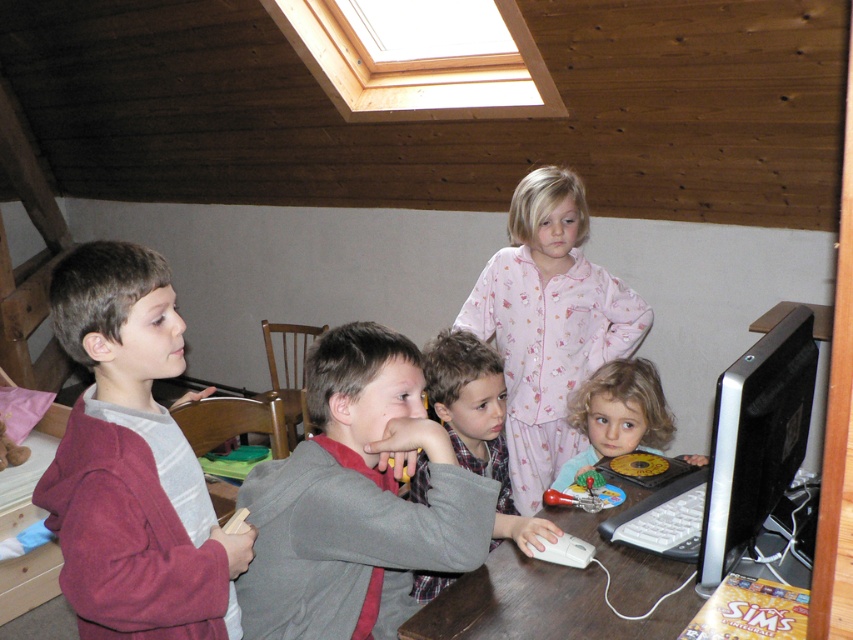
Who is more forward, [315,401] or [419,461]?

Point [315,401] is in front.

Is gray fabric shirt at center positioned at the back of gray flannel shirt at center?

No.

Is point (294, 634) farther from camera compared to point (467, 387)?

That is False.

At what (x,y) coordinates should I click in order to perform the action: click on gray fabric shirt at center. Please return your answer as a coordinate pair (x, y). The image size is (853, 640). Looking at the image, I should click on (352, 502).

Does brown wooden table at lower center have a lesser height compared to blonde curly hair at lower center?

Indeed, brown wooden table at lower center has a lesser height compared to blonde curly hair at lower center.

Between brown wooden table at lower center and blonde curly hair at lower center, which one has more height?

Standing taller between the two is blonde curly hair at lower center.

Identify the location of brown wooden table at lower center. (538, 604).

Which is in front, point (788, 328) or point (468, 465)?

Point (788, 328) is in front.

Is black glossy monitor at right smaller than gray flannel shirt at center?

Actually, black glossy monitor at right might be larger than gray flannel shirt at center.

Identify the location of black glossy monitor at right. The width and height of the screenshot is (853, 640). (755, 440).